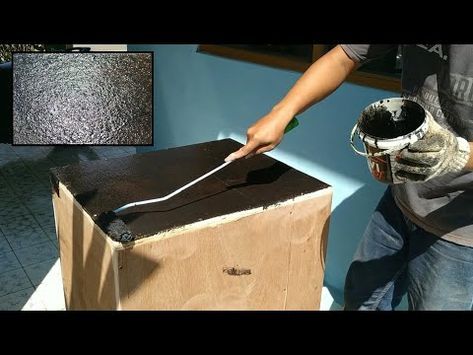
I want to click on space under window, so coord(244,86).